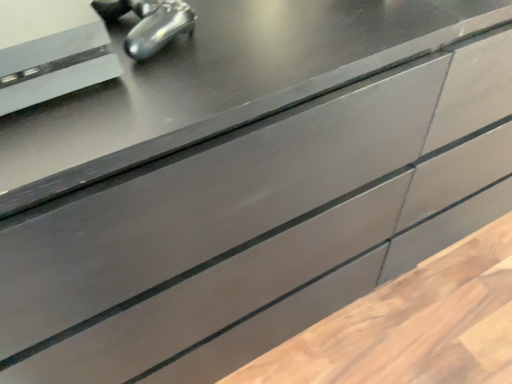
The width and height of the screenshot is (512, 384). I want to click on vacant space to the right of metallic silver tap at upper left, so click(269, 31).